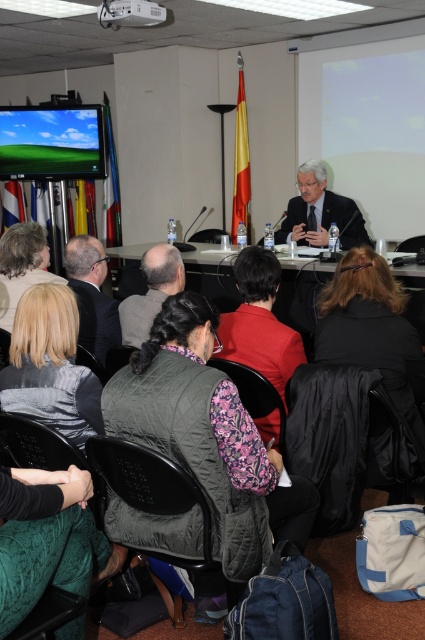
Question: Is black suit at center above dark gray vest at center?

Choices:
 (A) no
 (B) yes

Answer: (B)

Question: Which of the following is the farthest from the observer?

Choices:
 (A) (6, 243)
 (B) (221, 612)
 (C) (390, 244)

Answer: (C)

Question: Is blonde hair at lower left smaller than dark gray vest at center?

Choices:
 (A) yes
 (B) no

Answer: (B)

Question: Among these points, which one is farthest from the camera?

Choices:
 (A) pos(218,602)
 (B) pos(17,145)
 (C) pos(238,282)

Answer: (B)

Question: In this image, where is red matte jacket at center located relative to matte black monitor at upper left?

Choices:
 (A) below
 (B) above

Answer: (A)

Question: Which point is farther to the camera?

Choices:
 (A) matte white projection screen at upper right
 (B) white glossy table at center
 (C) red matte jacket at center

Answer: (A)